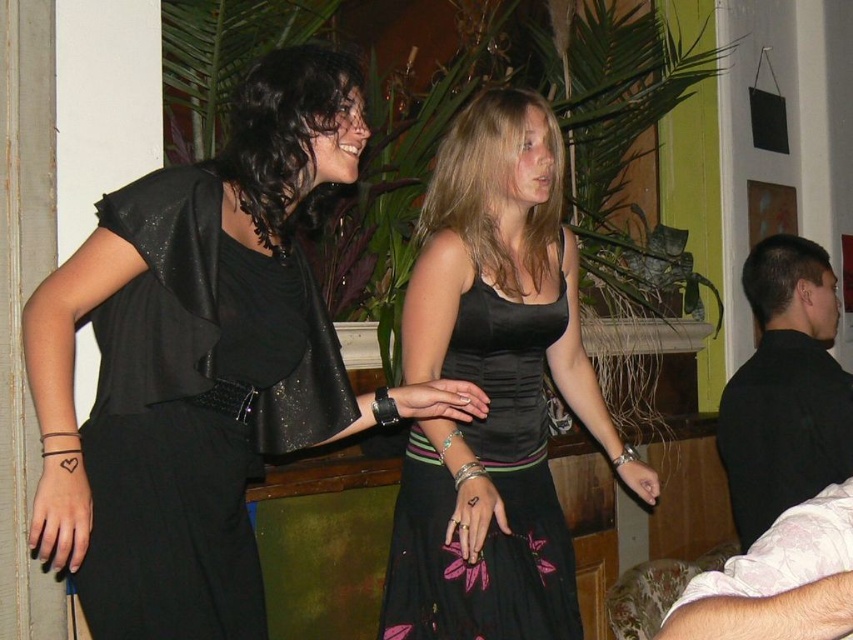
Looking at this image, you are standing in the room and see two women talking. There is a point marked at coordinates (495, 490). Which object from the scene does this point belong to?

The point at coordinates (495, 490) is on the black textured dress at center.

You are a fashion designer observing the scene. You need to determine which clothing item requires more fabric to produce between the black textured dress at center and the light pink floral shirt at lower right. Based on their sizes, which one would need more fabric?

The black textured dress at center has a larger size compared to the light pink floral shirt at lower right, so it would require more fabric to produce.

You are standing at the entrance of the room and see two points in the scene. The first point is labeled as point (402, 632) and the second is point (758, 593). Which point is closer to you?

Point (758, 593) is closer to you because it is in front of point (402, 632).